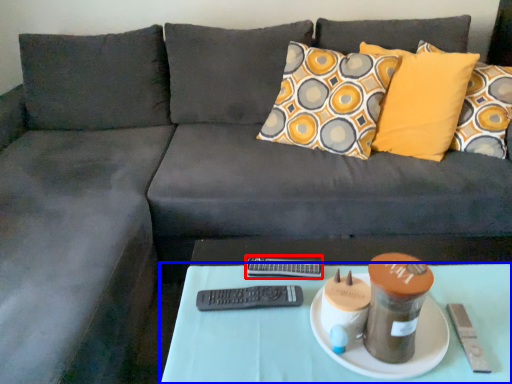
Question: Which of the following is the farthest to the observer, remote (highlighted by a red box) or table (highlighted by a blue box)?

Choices:
 (A) remote
 (B) table

Answer: (A)